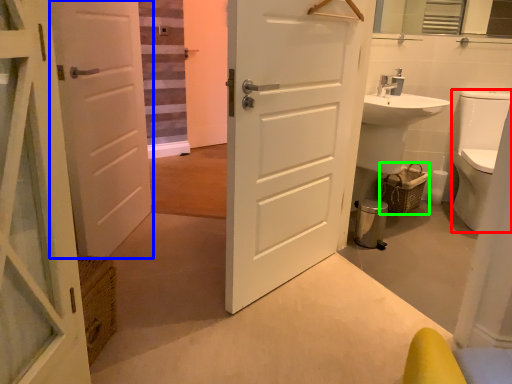
Question: Which is nearer to the toilet bowl (highlighted by a red box)? door (highlighted by a blue box) or basket (highlighted by a green box).

Choices:
 (A) door
 (B) basket

Answer: (B)